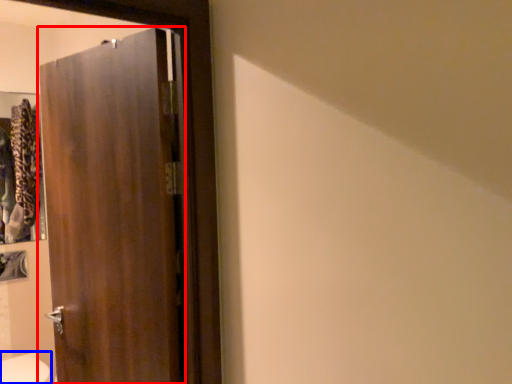
Question: Which object is closer to the camera taking this photo, door (highlighted by a red box) or bidet (highlighted by a blue box)?

Choices:
 (A) door
 (B) bidet

Answer: (A)